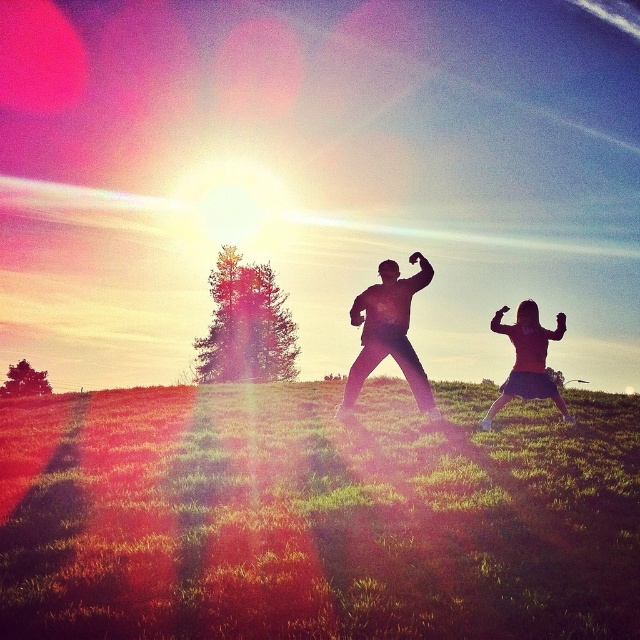
Question: Is green grassy at center bigger than matte pink skirt at lower right?

Choices:
 (A) yes
 (B) no

Answer: (A)

Question: Which object is the closest to the black matte pants at center?

Choices:
 (A) green grassy at center
 (B) matte pink skirt at lower right

Answer: (B)

Question: Which of these objects is positioned farthest from the matte pink skirt at lower right?

Choices:
 (A) black matte pants at center
 (B) green grassy at center

Answer: (B)

Question: Which point is closer to the camera?

Choices:
 (A) green grassy at center
 (B) matte pink skirt at lower right

Answer: (A)

Question: Is green grassy at center above black matte pants at center?

Choices:
 (A) no
 (B) yes

Answer: (A)

Question: Can you confirm if black matte pants at center is thinner than matte pink skirt at lower right?

Choices:
 (A) yes
 (B) no

Answer: (A)